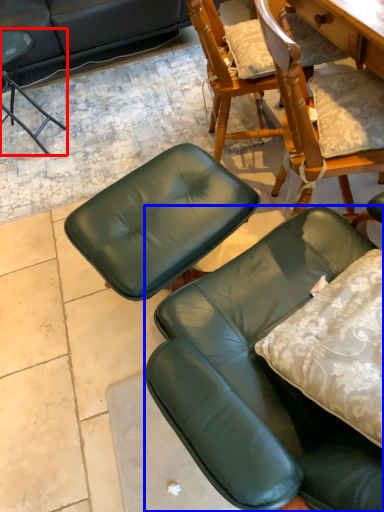
Question: Which of the following is the farthest to the observer, chair (highlighted by a red box) or chair (highlighted by a blue box)?

Choices:
 (A) chair
 (B) chair

Answer: (A)